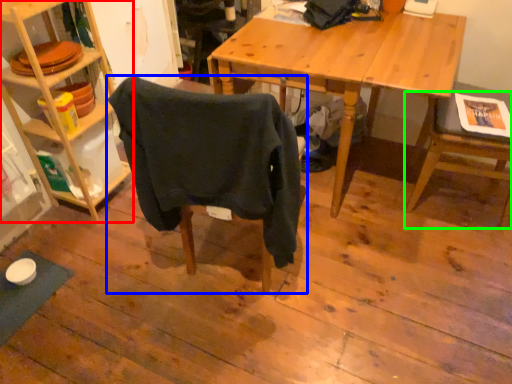
Question: Estimate the real-world distances between objects in this image. Which object is farther from shelf (highlighted by a red box), chair (highlighted by a blue box) or chair (highlighted by a green box)?

Choices:
 (A) chair
 (B) chair

Answer: (B)